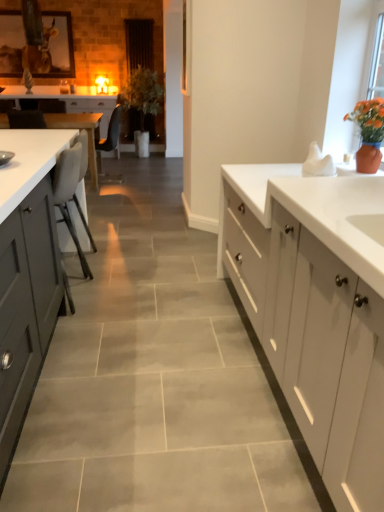
Question: From a real-world perspective, relative to green matte plant at center, is white matte cabinet at center, the second cabinetry when ordered from front to back, vertically above or below?

Choices:
 (A) below
 (B) above

Answer: (A)

Question: Is white matte cabinet at center, marked as the 2th cabinetry in a bottom-to-top arrangement, situated inside green matte plant at center or outside?

Choices:
 (A) inside
 (B) outside

Answer: (B)

Question: Which object is the closest to the green matte plant at center?

Choices:
 (A) white glossy countertop at right
 (B) white glossy table at left
 (C) matte gray chair at center, which ranks as the second chair in front-to-back order
 (D) beige fabric chair at left, positioned as the 2th chair in top-to-bottom order
 (E) white matte cabinet at center, positioned as the 1th cabinetry in back-to-front order

Answer: (C)

Question: Estimate the real-world distances between objects in this image. Which object is farther from the matte gray cabinets at left, which appears as the 1th cabinetry when viewed from the front?

Choices:
 (A) matte gray chair at center, placed as the second chair when sorted from bottom to top
 (B) white matte cabinet at center, positioned as the 1th cabinetry in back-to-front order
 (C) white glossy table at left
 (D) green matte plant at center
 (E) beige fabric chair at left, positioned as the 2th chair in top-to-bottom order

Answer: (D)